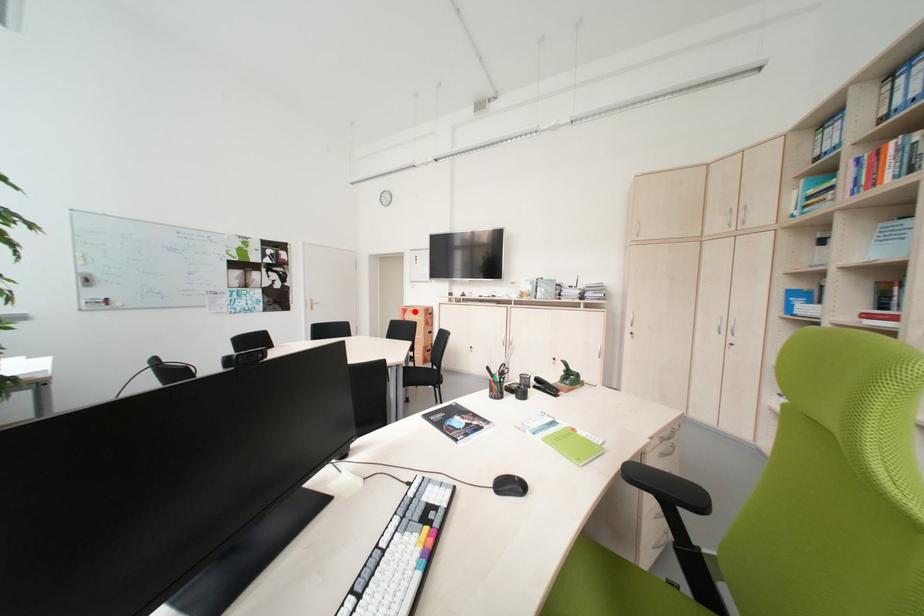
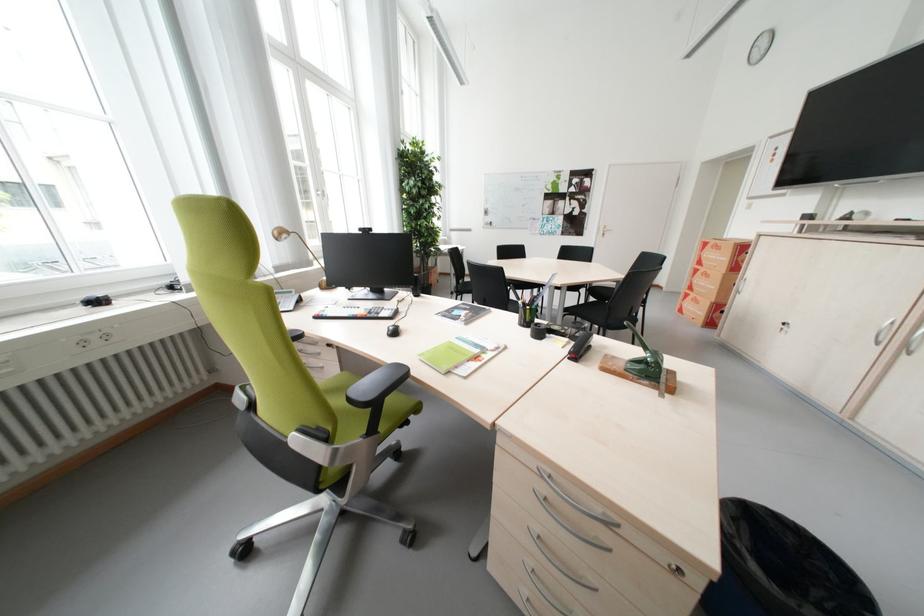
Locate, in the second image, the point that corresponds to the highlighted location in the first image.

(715, 246)